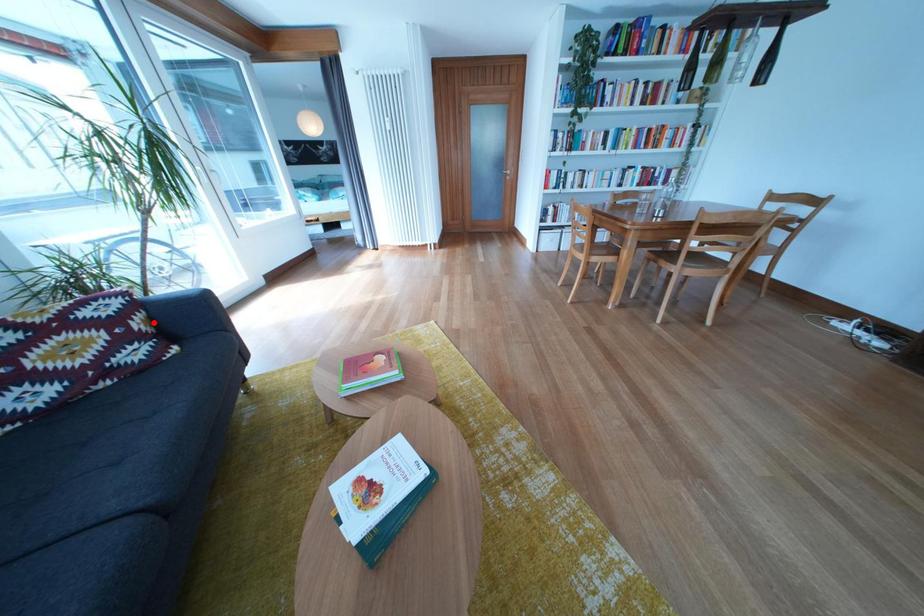
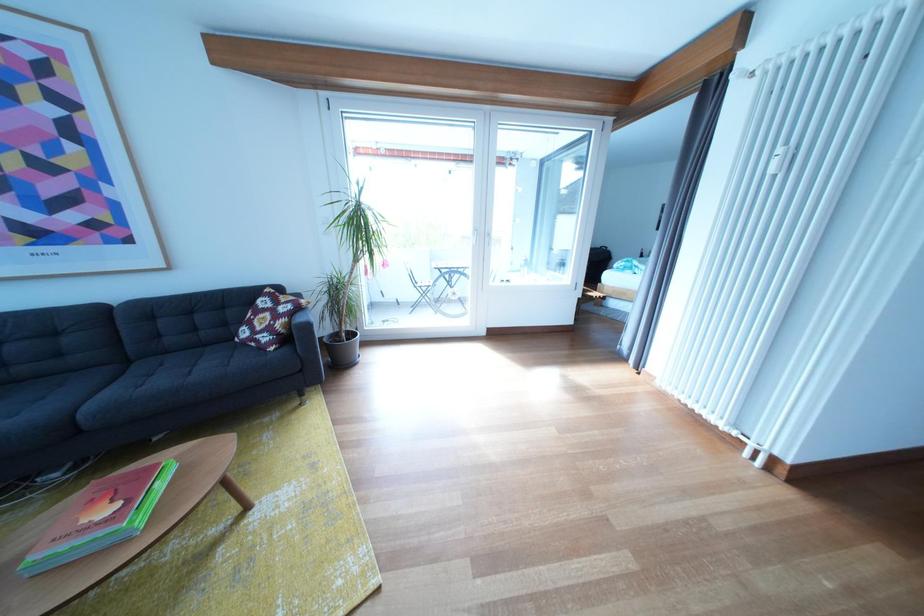
In the second image, find the point that corresponds to the highlighted location in the first image.

(296, 326)